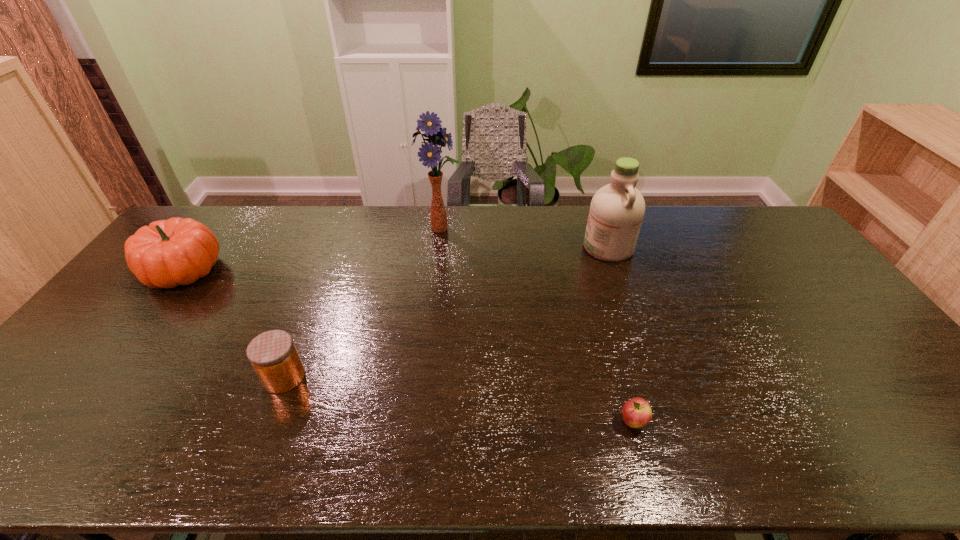
This screenshot has width=960, height=540. I want to click on free spot located 0.220m on the front label of the cleansing agent, so click(519, 247).

Identify the location of free space located on the front label of the cleansing agent. Image resolution: width=960 pixels, height=540 pixels. (467, 247).

Find the location of a particular element. The width and height of the screenshot is (960, 540). vacant area situated 0.240m on the front label of the cleansing agent is located at coordinates (514, 247).

I want to click on free region located on the right of the third shortest object, so click(265, 270).

Find the location of a particular element. This screenshot has height=540, width=960. vacant region located 0.150m on the front of the jar is located at coordinates [x=254, y=454].

Find the location of a particular element. Image resolution: width=960 pixels, height=540 pixels. blank space located 0.390m on the right of the nearest object is located at coordinates [x=814, y=422].

I want to click on flower arrangement present at the far edge, so click(x=431, y=124).

This screenshot has width=960, height=540. Find the location of `cleansing agent at the far edge`. cleansing agent at the far edge is located at coordinates (617, 209).

You are a GUI agent. You are given a task and a screenshot of the screen. Output one action in this format:
    pyautogui.click(x=<x>, y=<y>)
    Task: Click on the object present at the near edge
    This screenshot has height=540, width=960.
    Given the screenshot: What is the action you would take?
    pyautogui.click(x=637, y=413)

Find the location of a particular element. object that is at the left edge is located at coordinates (167, 253).